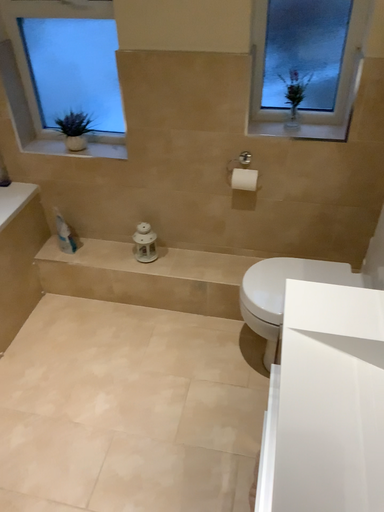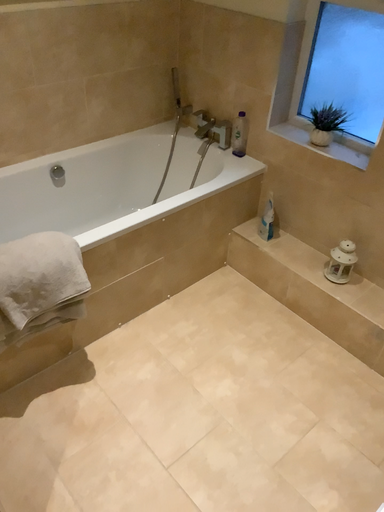
Question: Which way did the camera rotate in the video?

Choices:
 (A) rotated downward
 (B) rotated upward

Answer: (B)